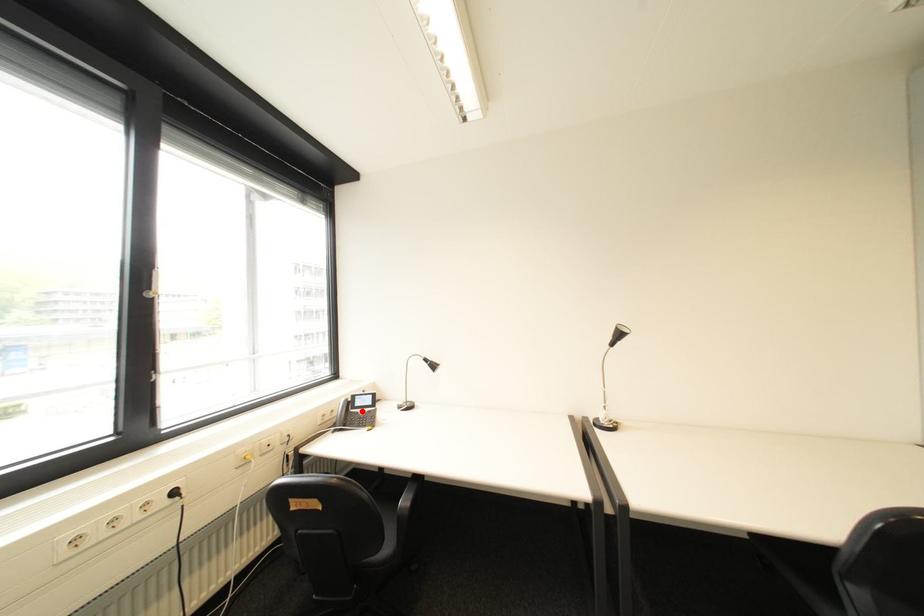
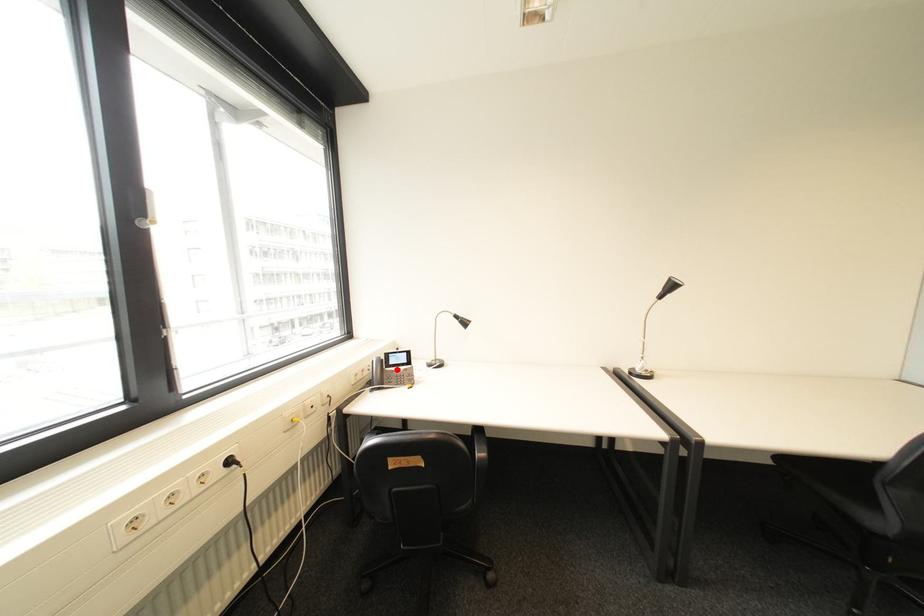
I am providing you with two images of the same scene from different viewpoints. A red point is marked on the first image and another point is marked on the second image. Is the red point in image1 aligned with the point shown in image2?

Yes